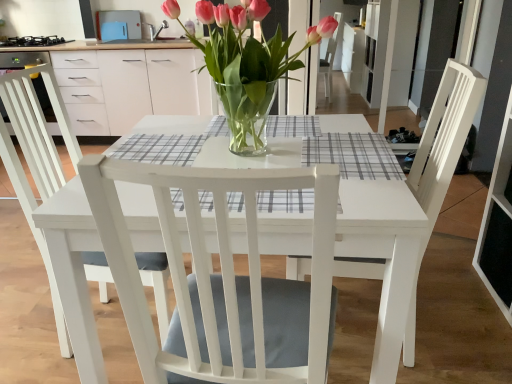
The image size is (512, 384). I want to click on plaid fabric at center, the 1th plaid ordered from the bottom, so click(286, 201).

This screenshot has width=512, height=384. Describe the element at coordinates (222, 279) in the screenshot. I see `white wood chair at center, positioned as the second chair in right-to-left order` at that location.

What do you see at coordinates (353, 155) in the screenshot? I see `gray checkered placemat at center, the 1th plaid positioned from the top` at bounding box center [353, 155].

Image resolution: width=512 pixels, height=384 pixels. I want to click on black matte stove at upper left, so [32, 41].

What do you see at coordinates (32, 41) in the screenshot? I see `black matte stove at upper left` at bounding box center [32, 41].

I want to click on clear glass vase at center, so click(248, 66).

Between black matte stove at upper left and plaid fabric at center, which appears as the first plaid when viewed from the front, which one has smaller size?

With smaller size is plaid fabric at center, which appears as the first plaid when viewed from the front.

Would you say plaid fabric at center, the 1th plaid ordered from the bottom, is part of black matte stove at upper left's contents?

That's incorrect, plaid fabric at center, the 1th plaid ordered from the bottom, is not inside black matte stove at upper left.

Would you consider black matte stove at upper left to be distant from plaid fabric at center, marked as the second plaid in a right-to-left arrangement?

black matte stove at upper left is far away from plaid fabric at center, marked as the second plaid in a right-to-left arrangement.

Who is taller, gray checkered placemat at center, the 1th plaid positioned from the top, or plaid fabric at center, which appears as the first plaid when viewed from the front?

Standing taller between the two is gray checkered placemat at center, the 1th plaid positioned from the top.

Is gray checkered placemat at center, the second plaid viewed from the left, situated inside plaid fabric at center, which appears as the first plaid when viewed from the front, or outside?

gray checkered placemat at center, the second plaid viewed from the left, exists outside the volume of plaid fabric at center, which appears as the first plaid when viewed from the front.

Find the location of a particular element. Image resolution: width=512 pixels, height=384 pixels. plaid above the gray checkered placemat at center, the second plaid viewed from the left (from a real-world perspective) is located at coordinates (286, 201).

Is gray checkered placemat at center, the 1th plaid positioned from the top, to the left of plaid fabric at center, which ranks as the second plaid in top-to-bottom order, from the viewer's perspective?

In fact, gray checkered placemat at center, the 1th plaid positioned from the top, is to the right of plaid fabric at center, which ranks as the second plaid in top-to-bottom order.

Is point (63, 42) closer to viewer compared to point (445, 179)?

No, it is not.

Are black matte stove at upper left and white wood chair at center, the 2th chair positioned from the left, making contact?

No, black matte stove at upper left is not next to white wood chair at center, the 2th chair positioned from the left.

Considering the sizes of objects black matte stove at upper left and white wood chair at center, the 2th chair positioned from the left, in the image provided, who is thinner, black matte stove at upper left or white wood chair at center, the 2th chair positioned from the left,?

With smaller width is black matte stove at upper left.

From a real-world perspective, which chair is the 2nd one underneath the plaid fabric at center, which ranks as the second plaid in top-to-bottom order? Please provide its 2D coordinates.

[(222, 279)]

From the image's perspective, is plaid fabric at center, marked as the second plaid in a right-to-left arrangement, beneath white wood chair at center, positioned as the second chair in right-to-left order?

Actually, plaid fabric at center, marked as the second plaid in a right-to-left arrangement, appears above white wood chair at center, positioned as the second chair in right-to-left order, in the image.

Considering the points (203, 209) and (279, 365), which point is behind, point (203, 209) or point (279, 365)?

The point (203, 209) is more distant.

Is plaid fabric at center, acting as the 2th plaid starting from the back, positioned far away from white wood chair at center, positioned as the second chair in right-to-left order?

They are positioned close to each other.

How much distance is there between gray checkered placemat at center, which is counted as the first plaid, starting from the right, and black matte stove at upper left?

A distance of 3.13 meters exists between gray checkered placemat at center, which is counted as the first plaid, starting from the right, and black matte stove at upper left.

From a real-world perspective, is gray checkered placemat at center, the 1th plaid positioned from the top, on top of black matte stove at upper left?

No, from a real-world perspective, gray checkered placemat at center, the 1th plaid positioned from the top, is not on top of black matte stove at upper left.

From the image's perspective, which one is positioned higher, gray checkered placemat at center, which is the second plaid from front to back, or black matte stove at upper left?

From the image's view, black matte stove at upper left is above.

Does gray checkered placemat at center, the 1th plaid positioned from the top, have a greater height compared to black matte stove at upper left?

No, gray checkered placemat at center, the 1th plaid positioned from the top, is not taller than black matte stove at upper left.

Measure the distance between white wood chair at center, the 2th chair positioned from the left, and gray checkered placemat at center, which is counted as the first plaid, starting from the right.

white wood chair at center, the 2th chair positioned from the left, and gray checkered placemat at center, which is counted as the first plaid, starting from the right, are 10.04 inches apart from each other.

Between white wood chair at center, the 2th chair positioned from the left, and gray checkered placemat at center, which is the second plaid from front to back, which one has less height?

gray checkered placemat at center, which is the second plaid from front to back, is shorter.

From the image's perspective, relative to gray checkered placemat at center, the 1th plaid positioned from the top, is white wood chair at center, the first chair positioned from the right, above or below?

white wood chair at center, the first chair positioned from the right, is situated lower than gray checkered placemat at center, the 1th plaid positioned from the top, in the image.

Looking at this image, would you say white wood chair at center, the 2th chair positioned from the left, is to the left or to the right of gray checkered placemat at center, the 1th plaid positioned from the top, in the picture?

From the image, it's evident that white wood chair at center, the 2th chair positioned from the left, is to the right of gray checkered placemat at center, the 1th plaid positioned from the top.

Considering the relative sizes of gray checkered placemat at center, the second plaid viewed from the left, and clear glass vase at center in the image provided, is gray checkered placemat at center, the second plaid viewed from the left, bigger than clear glass vase at center?

Actually, gray checkered placemat at center, the second plaid viewed from the left, might be smaller than clear glass vase at center.

Which point is more distant from viewer, [375,157] or [251,112]?

The point [251,112] is farther.

Is gray checkered placemat at center, the second plaid viewed from the left, aimed at clear glass vase at center?

No, gray checkered placemat at center, the second plaid viewed from the left, does not turn towards clear glass vase at center.

Where is `plaid that appears behind the clear glass vase at center`? plaid that appears behind the clear glass vase at center is located at coordinates (353, 155).

The width and height of the screenshot is (512, 384). Find the location of `appliance above the plaid fabric at center, which appears as the first plaid when viewed from the front (from the image's perspective)`. appliance above the plaid fabric at center, which appears as the first plaid when viewed from the front (from the image's perspective) is located at coordinates (32, 41).

The image size is (512, 384). What are the coordinates of `plaid above the gray checkered placemat at center, the 1th plaid positioned from the top (from a real-world perspective)` in the screenshot? It's located at (286, 201).

Consider the image. Considering their positions, is clear glass vase at center positioned closer to black matte stove at upper left than gray checkered placemat at center, the second plaid viewed from the left?

The object closer to black matte stove at upper left is clear glass vase at center.

Estimate the real-world distances between objects in this image. Which object is further from plaid fabric at center, the 1th plaid ordered from the bottom, white wood chair at center, the 1th chair viewed from the left, or gray checkered placemat at center, the 1th plaid positioned from the top?

white wood chair at center, the 1th chair viewed from the left, is positioned further to the anchor plaid fabric at center, the 1th plaid ordered from the bottom.

Which object lies nearer to the anchor point white wood chair at center, the 2th chair positioned from the left, plaid fabric at center, which appears as the first plaid when viewed from the front, or white wood chair at center, positioned as the second chair in right-to-left order?

plaid fabric at center, which appears as the first plaid when viewed from the front, lies closer to white wood chair at center, the 2th chair positioned from the left, than the other object.

When comparing their distances from gray checkered placemat at center, the second plaid viewed from the left, does plaid fabric at center, which appears as the first plaid when viewed from the front, or white wood chair at center, the 1th chair viewed from the left, seem further?

Based on the image, white wood chair at center, the 1th chair viewed from the left, appears to be further to gray checkered placemat at center, the second plaid viewed from the left.

Which object lies further to the anchor point gray checkered placemat at center, which is the first plaid in back-to-front order, plaid fabric at center, acting as the 1th plaid starting from the left, or black matte stove at upper left?

black matte stove at upper left lies further to gray checkered placemat at center, which is the first plaid in back-to-front order, than the other object.

Looking at this image, estimate the real-world distances between objects in this image. Which object is closer to white wood chair at center, positioned as the second chair in right-to-left order, clear glass vase at center or black matte stove at upper left?

clear glass vase at center is closer to white wood chair at center, positioned as the second chair in right-to-left order.

Estimate the real-world distances between objects in this image. Which object is closer to white wood chair at center, the 2th chair positioned from the left, clear glass vase at center or black matte stove at upper left?

clear glass vase at center.

Considering their positions, is white wood chair at center, positioned as the second chair in right-to-left order, positioned further to gray checkered placemat at center, which is the first plaid in back-to-front order, than plaid fabric at center, marked as the second plaid in a right-to-left arrangement?

white wood chair at center, positioned as the second chair in right-to-left order, lies further to gray checkered placemat at center, which is the first plaid in back-to-front order, than the other object.

I want to click on plaid between white wood chair at center, positioned as the second chair in right-to-left order, and gray checkered placemat at center, which is the first plaid in back-to-front order, in the horizontal direction, so click(x=286, y=201).

Where is `chair between clear glass vase at center and white wood chair at center, the 1th chair viewed from the left, in the up-down direction`? This screenshot has height=384, width=512. chair between clear glass vase at center and white wood chair at center, the 1th chair viewed from the left, in the up-down direction is located at coordinates (440, 160).

At what (x,y) coordinates should I click in order to perform the action: click on plaid positioned between white wood chair at center, the 2th chair positioned from the left, and black matte stove at upper left from near to far. Please return your answer as a coordinate pair (x, y). This screenshot has height=384, width=512. Looking at the image, I should click on (353, 155).

Find the location of a particular element. plaid between clear glass vase at center and plaid fabric at center, which ranks as the second plaid in top-to-bottom order, in the vertical direction is located at coordinates (353, 155).